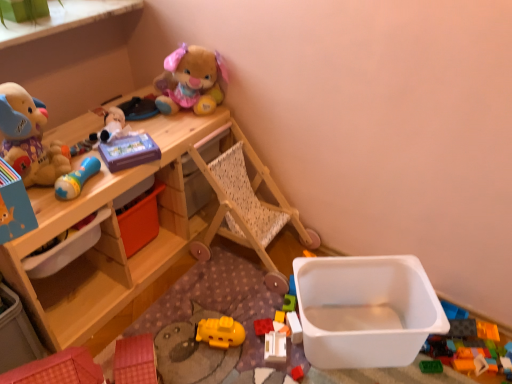
Find the location of a particular element. vacant space that is to the left of rubberized red block at center, the second toy from the bottom is located at coordinates (221, 314).